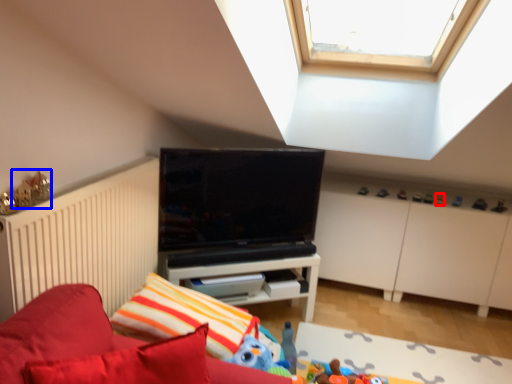
Question: Which object is further to the camera taking this photo, toy (highlighted by a red box) or toy (highlighted by a blue box)?

Choices:
 (A) toy
 (B) toy

Answer: (A)